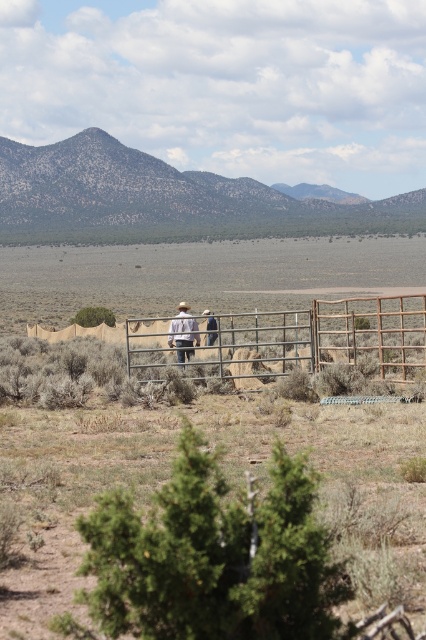
Question: Estimate the real-world distances between objects in this image. Which object is closer to the light brown leather cowboy hat at center?

Choices:
 (A) metallic wire fence at center
 (B) light brown leather jacket at center

Answer: (B)

Question: Which point is closer to the camera?

Choices:
 (A) (210, 337)
 (B) (368, 298)

Answer: (B)

Question: Does light brown leather cowboy hat at center appear under light brown leather jacket at center?

Choices:
 (A) yes
 (B) no

Answer: (A)

Question: Can you confirm if light brown leather cowboy hat at center is bigger than light brown leather jacket at center?

Choices:
 (A) yes
 (B) no

Answer: (A)

Question: Does light brown leather cowboy hat at center appear under light brown leather jacket at center?

Choices:
 (A) no
 (B) yes

Answer: (B)

Question: Which object is positioned closest to the light brown leather jacket at center?

Choices:
 (A) metallic wire fence at center
 (B) light brown leather cowboy hat at center

Answer: (B)